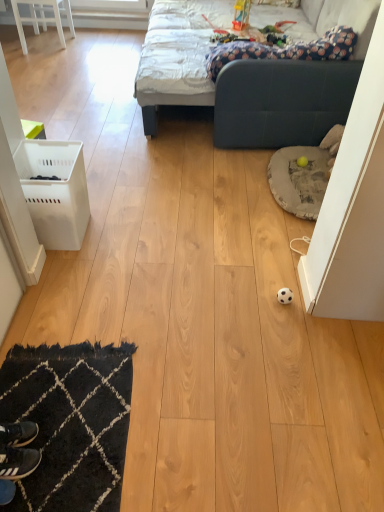
Question: From a real-world perspective, is white glossy chair at upper left positioned above or below white plastic laundry basket at left?

Choices:
 (A) below
 (B) above

Answer: (B)

Question: Based on their positions, is white glossy chair at upper left located to the left or right of white plastic laundry basket at left?

Choices:
 (A) right
 (B) left

Answer: (B)

Question: Estimate the real-world distances between objects in this image. Which object is farther from the white plastic laundry basket at left?

Choices:
 (A) black leather shoe at lower left
 (B) white glossy chair at upper left
 (C) black textured rug at lower left
 (D) dark blue fabric couch at upper center

Answer: (B)

Question: Which is nearer to the white glossy chair at upper left?

Choices:
 (A) black textured rug at lower left
 (B) white plastic laundry basket at left
 (C) black leather shoe at lower left
 (D) dark blue fabric couch at upper center

Answer: (D)